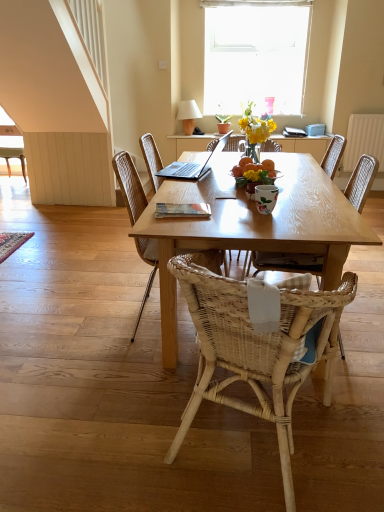
Locate an element on the screen. This screenshot has height=512, width=384. vacant area that is in front of white glossy coffee cup at center is located at coordinates (280, 221).